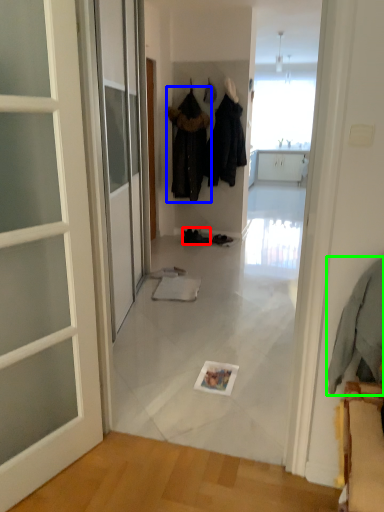
Question: Which object is the closest to the footwear (highlighted by a red box)? Choose among these: clothing (highlighted by a blue box) or clothing (highlighted by a green box).

Choices:
 (A) clothing
 (B) clothing

Answer: (A)